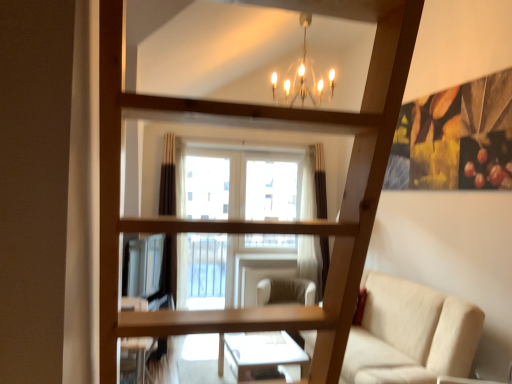
Question: Is beige fabric swivel chair at center at the back of beige fabric couch at lower right?

Choices:
 (A) no
 (B) yes

Answer: (A)

Question: From the image's perspective, does beige fabric couch at lower right appear lower than beige fabric swivel chair at center?

Choices:
 (A) no
 (B) yes

Answer: (A)

Question: Is beige fabric couch at lower right facing towards beige fabric swivel chair at center?

Choices:
 (A) yes
 (B) no

Answer: (B)

Question: Is beige fabric couch at lower right not inside beige fabric swivel chair at center?

Choices:
 (A) no
 (B) yes

Answer: (B)

Question: Is beige fabric couch at lower right not close to beige fabric swivel chair at center?

Choices:
 (A) no
 (B) yes

Answer: (B)

Question: Can beige fabric swivel chair at center be found inside beige fabric couch at lower right?

Choices:
 (A) yes
 (B) no

Answer: (B)

Question: Does beige fabric swivel chair at center have a greater width compared to beige fabric couch at lower right?

Choices:
 (A) no
 (B) yes

Answer: (A)

Question: Does beige fabric swivel chair at center lie behind beige fabric couch at lower right?

Choices:
 (A) yes
 (B) no

Answer: (A)

Question: Is beige fabric swivel chair at center to the left of beige fabric couch at lower right from the viewer's perspective?

Choices:
 (A) yes
 (B) no

Answer: (A)

Question: Considering the relative positions of beige fabric swivel chair at center and beige fabric couch at lower right in the image provided, is beige fabric swivel chair at center to the right of beige fabric couch at lower right from the viewer's perspective?

Choices:
 (A) yes
 (B) no

Answer: (B)

Question: From the image's perspective, does beige fabric swivel chair at center appear lower than beige fabric couch at lower right?

Choices:
 (A) yes
 (B) no

Answer: (A)

Question: Does beige fabric swivel chair at center have a greater height compared to beige fabric couch at lower right?

Choices:
 (A) no
 (B) yes

Answer: (A)

Question: From the image's perspective, is beige fabric couch at lower right located above or below beige fabric swivel chair at center?

Choices:
 (A) above
 (B) below

Answer: (A)